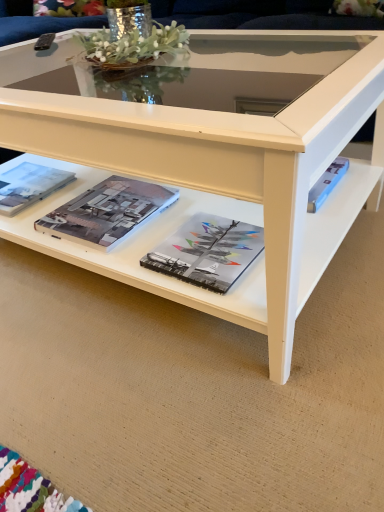
Describe the element at coordinates (107, 212) in the screenshot. I see `matte paper magazine at center, placed as the 2th magazine when sorted from right to left` at that location.

I want to click on matte hardcover book at center, the first magazine in the right-to-left sequence, so click(207, 252).

Where is `matte paper magazine at center, the second magazine from the left`? matte paper magazine at center, the second magazine from the left is located at coordinates (107, 212).

From a real-world perspective, is white glossy coffee table at center on matte paper magazine at center, placed as the 2th magazine when sorted from right to left?

Indeed, from a real-world perspective, white glossy coffee table at center stands above matte paper magazine at center, placed as the 2th magazine when sorted from right to left.

Looking at this image, would you say white glossy coffee table at center is a long distance from matte paper magazine at center, the second magazine from the left?

No, white glossy coffee table at center is not far away from matte paper magazine at center, the second magazine from the left.

Who is bigger, white glossy coffee table at center or matte paper magazine at center, placed as the 2th magazine when sorted from right to left?

Bigger between the two is white glossy coffee table at center.

How different are the orientations of white glossy coffee table at center and matte paper magazine at center, the second magazine from the left, in degrees?

white glossy coffee table at center and matte paper magazine at center, the second magazine from the left, are facing 1.91 degrees away from each other.

Would you consider matte hardcover book at center, positioned as the 3th magazine in left-to-right order, to be distant from white glossy coffee table at center?

No, matte hardcover book at center, positioned as the 3th magazine in left-to-right order, is not far away from white glossy coffee table at center.

Is white glossy coffee table at center at the back of matte hardcover book at center, the first magazine in the right-to-left sequence?

Yes, white glossy coffee table at center is at the back of matte hardcover book at center, the first magazine in the right-to-left sequence.

From the image's perspective, would you say matte hardcover book at center, the first magazine in the right-to-left sequence, is positioned over white glossy coffee table at center?

No, from the image's perspective, matte hardcover book at center, the first magazine in the right-to-left sequence, is not on top of white glossy coffee table at center.

Between matte hardcover book at center, positioned as the 3th magazine in left-to-right order, and matte paper magazine at center, the second magazine from the left, which one has less height?

matte hardcover book at center, positioned as the 3th magazine in left-to-right order.

What are the coordinates of `magazine that is the 1st object to the left of the matte hardcover book at center, positioned as the 3th magazine in left-to-right order, starting at the anchor` in the screenshot? It's located at (107, 212).

Is matte hardcover book at center, positioned as the 3th magazine in left-to-right order, wider than matte paper magazine at center, placed as the 2th magazine when sorted from right to left?

In fact, matte hardcover book at center, positioned as the 3th magazine in left-to-right order, might be narrower than matte paper magazine at center, placed as the 2th magazine when sorted from right to left.

Can you confirm if white glossy coffee table at center is taller than matte paper magazine at left, acting as the 3th magazine starting from the right?

Yes, white glossy coffee table at center is taller than matte paper magazine at left, acting as the 3th magazine starting from the right.

How distant is white glossy coffee table at center from matte paper magazine at left, acting as the 3th magazine starting from the right?

A distance of 17.66 inches exists between white glossy coffee table at center and matte paper magazine at left, acting as the 3th magazine starting from the right.

Considering the sizes of white glossy coffee table at center and matte paper magazine at left, the first magazine positioned from the left, in the image, is white glossy coffee table at center wider or thinner than matte paper magazine at left, the first magazine positioned from the left,?

white glossy coffee table at center is wider than matte paper magazine at left, the first magazine positioned from the left.

From the matte paper magazine at left, the first magazine positioned from the left, count 2nd magazines forward and point to it. Please provide its 2D coordinates.

[(207, 252)]

From the image's perspective, is matte hardcover book at center, the first magazine in the right-to-left sequence, below matte paper magazine at left, acting as the 3th magazine starting from the right?

Indeed, from the image's perspective, matte hardcover book at center, the first magazine in the right-to-left sequence, is shown beneath matte paper magazine at left, acting as the 3th magazine starting from the right.

Is point (192, 243) behind point (44, 188)?

No, it is not.

Is matte hardcover book at center, the first magazine in the right-to-left sequence, at the left side of matte paper magazine at left, the first magazine positioned from the left?

In fact, matte hardcover book at center, the first magazine in the right-to-left sequence, is to the right of matte paper magazine at left, the first magazine positioned from the left.

Is matte paper magazine at left, the first magazine positioned from the left, positioned with its back to matte hardcover book at center, the first magazine in the right-to-left sequence?

matte paper magazine at left, the first magazine positioned from the left, does not have its back to matte hardcover book at center, the first magazine in the right-to-left sequence.

Considering the sizes of objects matte paper magazine at left, the first magazine positioned from the left, and matte hardcover book at center, the first magazine in the right-to-left sequence, in the image provided, who is wider, matte paper magazine at left, the first magazine positioned from the left, or matte hardcover book at center, the first magazine in the right-to-left sequence,?

With larger width is matte paper magazine at left, the first magazine positioned from the left.

How many degrees apart are the facing directions of matte paper magazine at left, the first magazine positioned from the left, and matte hardcover book at center, the first magazine in the right-to-left sequence?

matte paper magazine at left, the first magazine positioned from the left, and matte hardcover book at center, the first magazine in the right-to-left sequence, are facing 2.92 degrees away from each other.

Which is farther, [25,187] or [165,269]?

The point [25,187] is behind.

Considering the relative sizes of matte paper magazine at left, acting as the 3th magazine starting from the right, and matte paper magazine at center, the second magazine from the left, in the image provided, is matte paper magazine at left, acting as the 3th magazine starting from the right, wider than matte paper magazine at center, the second magazine from the left,?

No, matte paper magazine at left, acting as the 3th magazine starting from the right, is not wider than matte paper magazine at center, the second magazine from the left.

Relative to matte paper magazine at center, the second magazine from the left, is matte paper magazine at left, the first magazine positioned from the left, in front or behind?

In the image, matte paper magazine at left, the first magazine positioned from the left, appears behind matte paper magazine at center, the second magazine from the left.

Measure the distance between matte paper magazine at left, acting as the 3th magazine starting from the right, and matte paper magazine at center, the second magazine from the left.

A distance of 9.29 inches exists between matte paper magazine at left, acting as the 3th magazine starting from the right, and matte paper magazine at center, the second magazine from the left.

From the image's perspective, between matte paper magazine at left, acting as the 3th magazine starting from the right, and matte paper magazine at center, placed as the 2th magazine when sorted from right to left, which one is located above?

matte paper magazine at left, acting as the 3th magazine starting from the right.

This screenshot has width=384, height=512. In the image, there is a matte paper magazine at center, placed as the 2th magazine when sorted from right to left. Identify the location of coffee table above it (from the image's perspective). (213, 163).

Image resolution: width=384 pixels, height=512 pixels. I want to click on coffee table lying on the left of matte hardcover book at center, positioned as the 3th magazine in left-to-right order, so click(213, 163).

Based on their spatial positions, is matte paper magazine at center, placed as the 2th magazine when sorted from right to left, or matte paper magazine at left, the first magazine positioned from the left, closer to matte hardcover book at center, positioned as the 3th magazine in left-to-right order?

matte paper magazine at center, placed as the 2th magazine when sorted from right to left, is closer to matte hardcover book at center, positioned as the 3th magazine in left-to-right order.

Considering their positions, is matte hardcover book at center, positioned as the 3th magazine in left-to-right order, positioned closer to matte paper magazine at center, the second magazine from the left, than white glossy coffee table at center?

matte hardcover book at center, positioned as the 3th magazine in left-to-right order, lies closer to matte paper magazine at center, the second magazine from the left, than the other object.

Which object lies further to the anchor point matte paper magazine at left, acting as the 3th magazine starting from the right, white glossy coffee table at center or matte paper magazine at center, the second magazine from the left?

Among the two, white glossy coffee table at center is located further to matte paper magazine at left, acting as the 3th magazine starting from the right.

Considering their positions, is white glossy coffee table at center positioned further to matte paper magazine at center, the second magazine from the left, than matte paper magazine at left, acting as the 3th magazine starting from the right?

The object further to matte paper magazine at center, the second magazine from the left, is matte paper magazine at left, acting as the 3th magazine starting from the right.

Estimate the real-world distances between objects in this image. Which object is further from matte paper magazine at center, the second magazine from the left, matte paper magazine at left, acting as the 3th magazine starting from the right, or white glossy coffee table at center?

matte paper magazine at left, acting as the 3th magazine starting from the right, lies further to matte paper magazine at center, the second magazine from the left, than the other object.

From the image, which object appears to be farther from matte paper magazine at center, placed as the 2th magazine when sorted from right to left, matte paper magazine at left, acting as the 3th magazine starting from the right, or matte hardcover book at center, the first magazine in the right-to-left sequence?

matte paper magazine at left, acting as the 3th magazine starting from the right, is further to matte paper magazine at center, placed as the 2th magazine when sorted from right to left.

Looking at the image, which one is located further to matte hardcover book at center, positioned as the 3th magazine in left-to-right order, white glossy coffee table at center or matte paper magazine at center, placed as the 2th magazine when sorted from right to left?

white glossy coffee table at center lies further to matte hardcover book at center, positioned as the 3th magazine in left-to-right order, than the other object.

Based on their spatial positions, is matte paper magazine at center, the second magazine from the left, or white glossy coffee table at center further from matte hardcover book at center, the first magazine in the right-to-left sequence?

white glossy coffee table at center is positioned further to the anchor matte hardcover book at center, the first magazine in the right-to-left sequence.

Image resolution: width=384 pixels, height=512 pixels. Find the location of `magazine between white glossy coffee table at center and matte paper magazine at center, placed as the 2th magazine when sorted from right to left, from top to bottom`. magazine between white glossy coffee table at center and matte paper magazine at center, placed as the 2th magazine when sorted from right to left, from top to bottom is located at coordinates (29, 186).

Find the location of `magazine between matte paper magazine at left, the first magazine positioned from the left, and matte hardcover book at center, positioned as the 3th magazine in left-to-right order`. magazine between matte paper magazine at left, the first magazine positioned from the left, and matte hardcover book at center, positioned as the 3th magazine in left-to-right order is located at coordinates (107, 212).